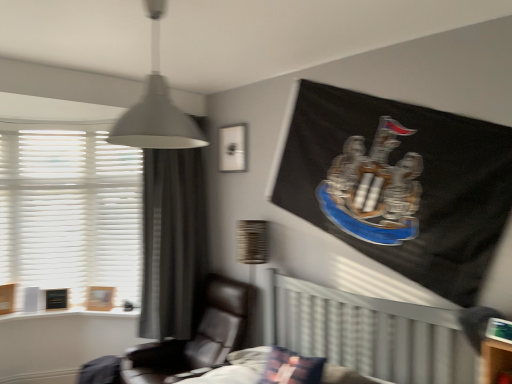
I want to click on gray fabric curtain at left, so point(172,241).

What do you see at coordinates (172, 241) in the screenshot?
I see `gray fabric curtain at left` at bounding box center [172, 241].

The height and width of the screenshot is (384, 512). I want to click on matte white picture frame at upper center, positioned as the second picture frame in back-to-front order, so click(x=233, y=148).

This screenshot has height=384, width=512. I want to click on white matte lampshade at upper center, so click(x=156, y=106).

Find the location of `wooden frame at lower left, which appears as the 2th picture frame when viewed from the right`. wooden frame at lower left, which appears as the 2th picture frame when viewed from the right is located at coordinates (100, 298).

In terms of height, does gray fabric curtain at left look taller or shorter compared to black leather chair at center?

Clearly, gray fabric curtain at left is taller compared to black leather chair at center.

Considering the relative positions of gray fabric curtain at left and black leather chair at center in the image provided, is gray fabric curtain at left to the left or to the right of black leather chair at center?

gray fabric curtain at left is to the left of black leather chair at center.

Does point (153, 305) come farther from viewer compared to point (233, 325)?

Yes.

Does gray fabric curtain at left have a lesser width compared to black leather chair at center?

Yes, gray fabric curtain at left is thinner than black leather chair at center.

Can matte white picture frame at upper center, the 1th picture frame positioned from the top, be found inside white matte lampshade at upper center?

No, matte white picture frame at upper center, the 1th picture frame positioned from the top, is located outside of white matte lampshade at upper center.

Considering the positions of point (167, 108) and point (222, 149), is point (167, 108) closer or farther from the camera than point (222, 149)?

Point (167, 108) is positioned closer to the camera compared to point (222, 149).

Considering the relative sizes of white matte lampshade at upper center and matte white picture frame at upper center, positioned as the second picture frame in back-to-front order, in the image provided, is white matte lampshade at upper center smaller than matte white picture frame at upper center, positioned as the second picture frame in back-to-front order,?

No.

This screenshot has height=384, width=512. What are the coordinates of `lamp above the matte white picture frame at upper center, positioned as the second picture frame in back-to-front order (from a real-world perspective)` in the screenshot? It's located at (156, 106).

Is white textured blinds at left next to white matte lampshade at upper center and touching it?

No, white textured blinds at left is not beside white matte lampshade at upper center.

Which point is more distant from viewer, [105,203] or [172,132]?

The point [105,203] is more distant.

Is white textured blinds at left closer to the viewer compared to white matte lampshade at upper center?

No, the depth of white textured blinds at left is greater than that of white matte lampshade at upper center.

In the scene shown: From the image's perspective, is white textured blinds at left beneath white matte lampshade at upper center?

Correct, white textured blinds at left appears lower than white matte lampshade at upper center in the image.

Is white textured blinds at left not near matte white picture frame at upper center, which is counted as the first picture frame, starting from the front?

Absolutely, white textured blinds at left is distant from matte white picture frame at upper center, which is counted as the first picture frame, starting from the front.

What's the angular difference between white textured blinds at left and matte white picture frame at upper center, which is the first picture frame in right-to-left order,'s facing directions?

64.5 degrees.

From the image's perspective, is white textured blinds at left located above or below matte white picture frame at upper center, the 1th picture frame positioned from the top?

white textured blinds at left is situated lower than matte white picture frame at upper center, the 1th picture frame positioned from the top, in the image.

Is gray fabric curtain at left thinner than wooden textured lampshade at center?

Incorrect, the width of gray fabric curtain at left is not less than that of wooden textured lampshade at center.

How far apart are gray fabric curtain at left and wooden textured lampshade at center?

They are 30.19 inches apart.

Is gray fabric curtain at left oriented towards wooden textured lampshade at center?

Yes, gray fabric curtain at left is turned towards wooden textured lampshade at center.

Which object is positioned more to the left, gray fabric curtain at left or wooden textured lampshade at center?

gray fabric curtain at left.

Is matte white picture frame at upper center, positioned as the second picture frame in back-to-front order, positioned with its back to black leather chair at center?

That's not correct — matte white picture frame at upper center, positioned as the second picture frame in back-to-front order, is not looking away from black leather chair at center.

Is black leather chair at center surrounded by matte white picture frame at upper center, acting as the second picture frame starting from the left?

No, matte white picture frame at upper center, acting as the second picture frame starting from the left, does not contain black leather chair at center.

Which is closer to the camera, (228, 165) or (215, 319)?

Point (228, 165).

From a real-world perspective, who is located higher, matte white picture frame at upper center, the second picture frame ordered from the bottom, or black leather chair at center?

In real-world perspective, matte white picture frame at upper center, the second picture frame ordered from the bottom, is above.

Is black leather chair at center inside wooden frame at lower left, the 2th picture frame positioned from the front?

No.

In terms of size, does wooden frame at lower left, which is the 1th picture frame in bottom-to-top order, appear bigger or smaller than black leather chair at center?

wooden frame at lower left, which is the 1th picture frame in bottom-to-top order, is smaller than black leather chair at center.

Is wooden frame at lower left, which is the 1th picture frame in bottom-to-top order, next to black leather chair at center?

Result: There is a gap between wooden frame at lower left, which is the 1th picture frame in bottom-to-top order, and black leather chair at center.

What's the angular difference between wooden frame at lower left, positioned as the first picture frame in back-to-front order, and black leather chair at center's facing directions?

wooden frame at lower left, positioned as the first picture frame in back-to-front order, and black leather chair at center are facing 42.2 degrees away from each other.

Identify the location of curtain above the black leather chair at center (from the image's perspective). [172, 241].

Image resolution: width=512 pixels, height=384 pixels. Identify the location of lamp that appears in front of the matte white picture frame at upper center, the 1th picture frame positioned from the top. (156, 106).

From the image, which object appears to be nearer to matte white picture frame at upper center, positioned as the second picture frame in back-to-front order, gray fabric curtain at left or wooden textured lampshade at center?

wooden textured lampshade at center is closer to matte white picture frame at upper center, positioned as the second picture frame in back-to-front order.

Which object lies nearer to the anchor point matte white picture frame at upper center, which is counted as the first picture frame, starting from the front, wooden frame at lower left, positioned as the first picture frame in back-to-front order, or white textured blinds at left?

white textured blinds at left is closer to matte white picture frame at upper center, which is counted as the first picture frame, starting from the front.

Which object lies further to the anchor point gray fabric curtain at left, wooden frame at lower left, positioned as the first picture frame in back-to-front order, or plush fabric pillow at center?

Among the two, plush fabric pillow at center is located further to gray fabric curtain at left.

Estimate the real-world distances between objects in this image. Which object is further from matte white picture frame at upper center, the second picture frame ordered from the bottom, white textured blinds at left or white matte lampshade at upper center?

Based on the image, white matte lampshade at upper center appears to be further to matte white picture frame at upper center, the second picture frame ordered from the bottom.

Based on their spatial positions, is plush fabric pillow at center or wooden textured lampshade at center further from gray fabric curtain at left?

→ plush fabric pillow at center is further to gray fabric curtain at left.

From the image, which object appears to be nearer to wooden frame at lower left, the 2th picture frame positioned from the front, matte white picture frame at upper center, the 1th picture frame positioned from the top, or plush fabric pillow at center?

matte white picture frame at upper center, the 1th picture frame positioned from the top, is closer to wooden frame at lower left, the 2th picture frame positioned from the front.

When comparing their distances from white textured blinds at left, does plush fabric pillow at center or wooden frame at lower left, positioned as the first picture frame in back-to-front order, seem closer?

wooden frame at lower left, positioned as the first picture frame in back-to-front order, lies closer to white textured blinds at left than the other object.

From the image, which object appears to be farther from white textured blinds at left, plush fabric pillow at center or black leather chair at center?

The object further to white textured blinds at left is plush fabric pillow at center.

Find the location of a particular element. Image resolution: width=512 pixels, height=384 pixels. table lamp positioned between plush fabric pillow at center and matte white picture frame at upper center, which is the first picture frame in right-to-left order, from near to far is located at coordinates (253, 245).

Identify the location of curtain located between plush fabric pillow at center and wooden frame at lower left, positioned as the first picture frame in left-to-right order, in the depth direction. (172, 241).

Where is `chair between white matte lampshade at upper center and gray fabric curtain at left along the z-axis`? This screenshot has height=384, width=512. chair between white matte lampshade at upper center and gray fabric curtain at left along the z-axis is located at coordinates (196, 336).

The image size is (512, 384). Find the location of `chair between plush fabric pillow at center and wooden textured lampshade at center from front to back`. chair between plush fabric pillow at center and wooden textured lampshade at center from front to back is located at coordinates (196, 336).